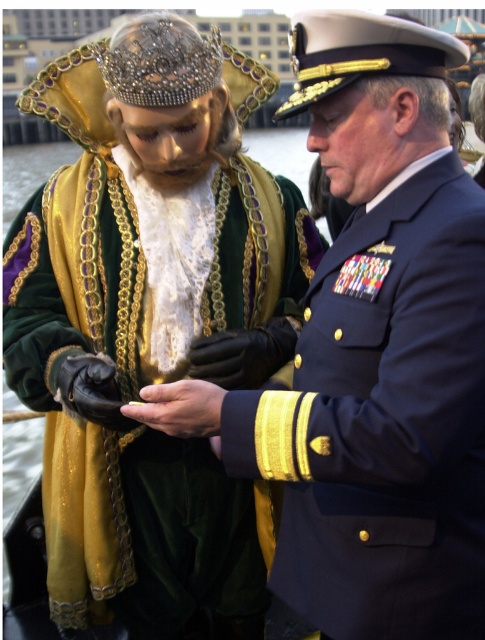
Which is in front, point (408, 179) or point (145, 404)?

Point (145, 404)

Can you confirm if navy blue uniform at center is positioned below matte black hand at center?

No.

This screenshot has width=485, height=640. Describe the element at coordinates (380, 352) in the screenshot. I see `navy blue uniform at center` at that location.

Where is `navy blue uniform at center`? The width and height of the screenshot is (485, 640). navy blue uniform at center is located at coordinates (380, 352).

Looking at this image, which is more to the left, shiny blue uniform at center or navy blue uniform at center?

Positioned to the left is shiny blue uniform at center.

This screenshot has height=640, width=485. What are the coordinates of `shiny blue uniform at center` in the screenshot? It's located at (151, 324).

What are the coordinates of `shiny blue uniform at center` in the screenshot? It's located at (151, 324).

Does shiny blue uniform at center appear over matte black hand at center?

Indeed, shiny blue uniform at center is positioned over matte black hand at center.

Identify the location of shiny blue uniform at center. This screenshot has height=640, width=485. (151, 324).

Where is `shiny blue uniform at center`? The image size is (485, 640). shiny blue uniform at center is located at coordinates (151, 324).

At what (x,y) coordinates should I click in order to perform the action: click on shiny blue uniform at center. Please return your answer as a coordinate pair (x, y). Looking at the image, I should click on (151, 324).